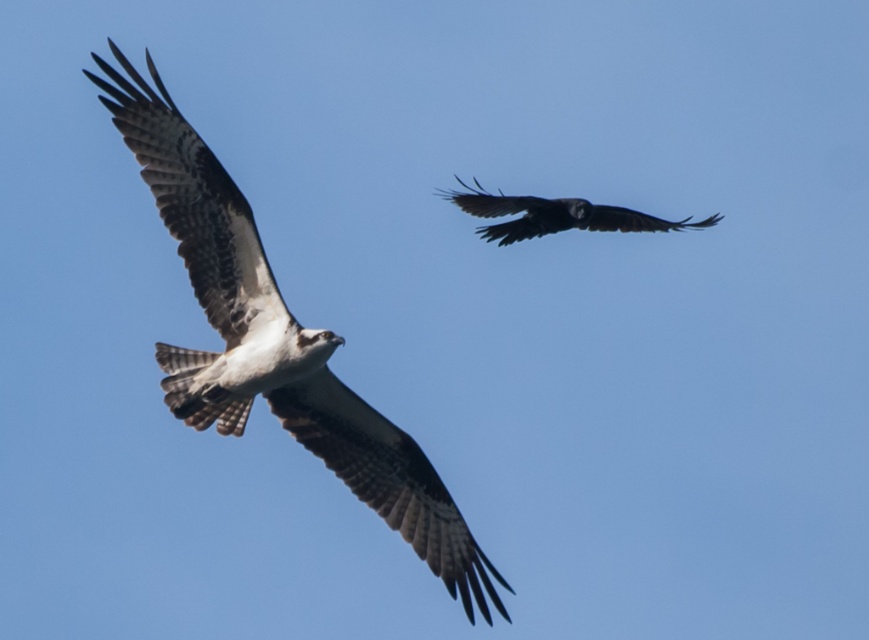
Question: Which point is closer to the camera?

Choices:
 (A) (569, 200)
 (B) (249, 326)

Answer: (B)

Question: Is brown speckled feathers at center to the left of dark glossy raven at upper center from the viewer's perspective?

Choices:
 (A) no
 (B) yes

Answer: (B)

Question: Is brown speckled feathers at center closer to camera compared to dark glossy raven at upper center?

Choices:
 (A) no
 (B) yes

Answer: (B)

Question: Does brown speckled feathers at center lie in front of dark glossy raven at upper center?

Choices:
 (A) yes
 (B) no

Answer: (A)